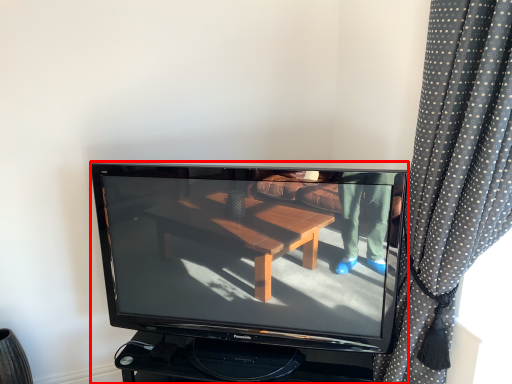
Question: Observing the image, what is the correct spatial positioning of television (annotated by the red box) in reference to curtain?

Choices:
 (A) left
 (B) right

Answer: (A)